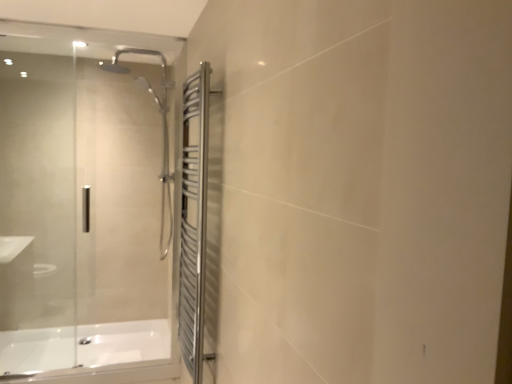
Question: Is polished stainless steel towel rack at right far away from white glossy bathtub at lower left?

Choices:
 (A) yes
 (B) no

Answer: (A)

Question: Considering the relative positions of polished stainless steel towel rack at right and white glossy bathtub at lower left in the image provided, is polished stainless steel towel rack at right to the right of white glossy bathtub at lower left from the viewer's perspective?

Choices:
 (A) yes
 (B) no

Answer: (A)

Question: Does polished stainless steel towel rack at right come in front of white glossy bathtub at lower left?

Choices:
 (A) no
 (B) yes

Answer: (B)

Question: Is polished stainless steel towel rack at right placed right next to white glossy bathtub at lower left?

Choices:
 (A) no
 (B) yes

Answer: (A)

Question: From a real-world perspective, is polished stainless steel towel rack at right physically below white glossy bathtub at lower left?

Choices:
 (A) yes
 (B) no

Answer: (B)

Question: From a real-world perspective, is transparent glass door at left above or below polished stainless steel towel rack at right?

Choices:
 (A) below
 (B) above

Answer: (B)

Question: From the image's perspective, is transparent glass door at left positioned above or below polished stainless steel towel rack at right?

Choices:
 (A) above
 (B) below

Answer: (A)

Question: In the image, is transparent glass door at left on the left side or the right side of polished stainless steel towel rack at right?

Choices:
 (A) right
 (B) left

Answer: (B)

Question: Considering the positions of transparent glass door at left and polished stainless steel towel rack at right in the image, is transparent glass door at left wider or thinner than polished stainless steel towel rack at right?

Choices:
 (A) thin
 (B) wide

Answer: (A)

Question: Considering the relative positions of transparent glass door at left and white glossy bathtub at lower left in the image provided, is transparent glass door at left to the left or to the right of white glossy bathtub at lower left?

Choices:
 (A) right
 (B) left

Answer: (A)

Question: Is point (163, 46) closer or farther from the camera than point (112, 372)?

Choices:
 (A) farther
 (B) closer

Answer: (A)

Question: Is transparent glass door at left wider or thinner than white glossy bathtub at lower left?

Choices:
 (A) wide
 (B) thin

Answer: (B)

Question: Considering their positions, is transparent glass door at left located in front of or behind white glossy bathtub at lower left?

Choices:
 (A) behind
 (B) front

Answer: (B)

Question: From the image's perspective, is white glossy bathtub at lower left positioned above or below polished stainless steel towel rack at right?

Choices:
 (A) below
 (B) above

Answer: (A)

Question: Is white glossy bathtub at lower left bigger or smaller than polished stainless steel towel rack at right?

Choices:
 (A) small
 (B) big

Answer: (B)